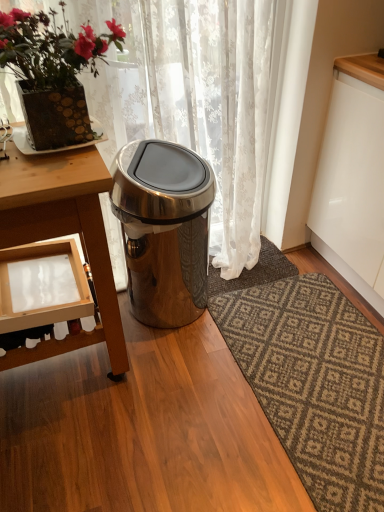
Question: Considering the positions of satin silver trash can at center and wooden table at left in the image, is satin silver trash can at center wider or thinner than wooden table at left?

Choices:
 (A) wide
 (B) thin

Answer: (B)

Question: Is satin silver trash can at center bigger or smaller than wooden table at left?

Choices:
 (A) small
 (B) big

Answer: (A)

Question: Which object is positioned farthest from the dark gray textured rug at center?

Choices:
 (A) dark brown textured rug at lower right
 (B) matte gold pot at upper left
 (C) white lace curtain at upper center
 (D) satin silver trash can at center
 (E) wooden table at left

Answer: (B)

Question: Based on their relative distances, which object is nearer to the white lace curtain at upper center?

Choices:
 (A) satin silver trash can at center
 (B) matte gold pot at upper left
 (C) dark brown textured rug at lower right
 (D) wooden table at left
 (E) dark gray textured rug at center

Answer: (A)